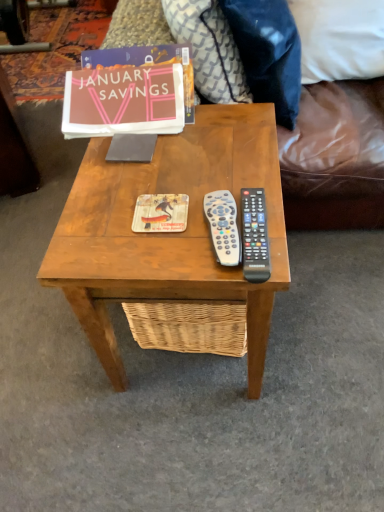
Find the location of a particular element. vacant space to the right of wooden coffee table at center is located at coordinates (327, 310).